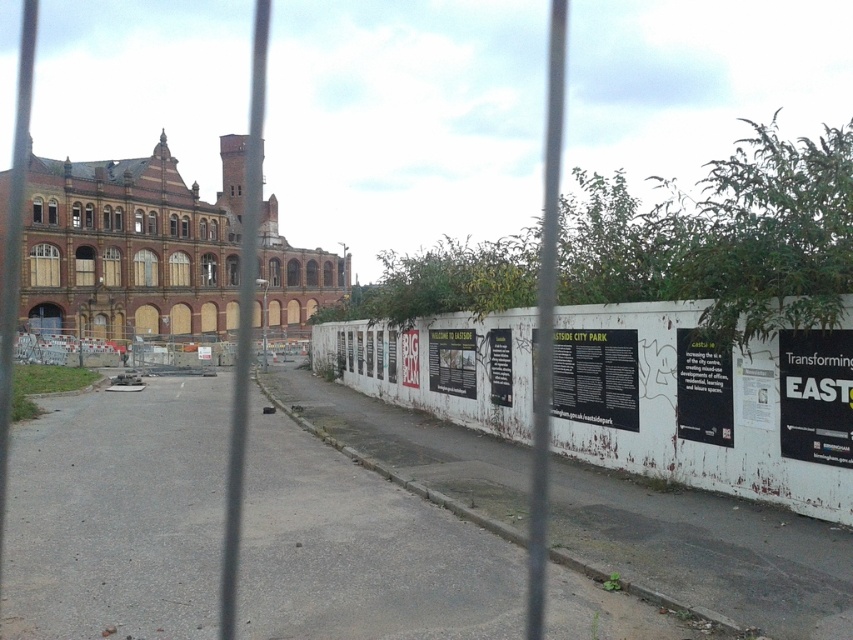
Question: Which of the following is the closest to the observer?

Choices:
 (A) (438, 372)
 (B) (711, 396)
 (C) (799, 413)

Answer: (C)

Question: Is black paper at right wider than white paper poster at center?

Choices:
 (A) no
 (B) yes

Answer: (A)

Question: Where is black paper at right located in relation to green paper poster at center in the image?

Choices:
 (A) below
 (B) above

Answer: (B)

Question: Which object is the closest to the white paper poster at center?

Choices:
 (A) green paper poster at center
 (B) black paper at right

Answer: (A)

Question: Which object appears farthest from the camera in this image?

Choices:
 (A) black paper at right
 (B) white paper poster at center

Answer: (B)

Question: Is green paper poster at center thinner than white paper poster at center?

Choices:
 (A) yes
 (B) no

Answer: (A)